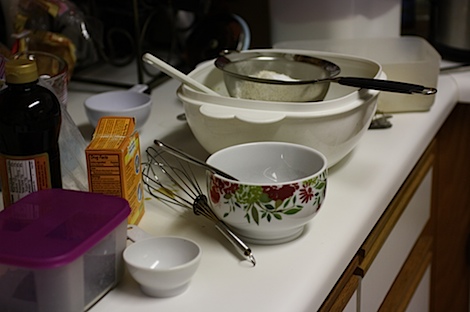
Find the location of `tupperware container`. tupperware container is located at coordinates [x=74, y=275].